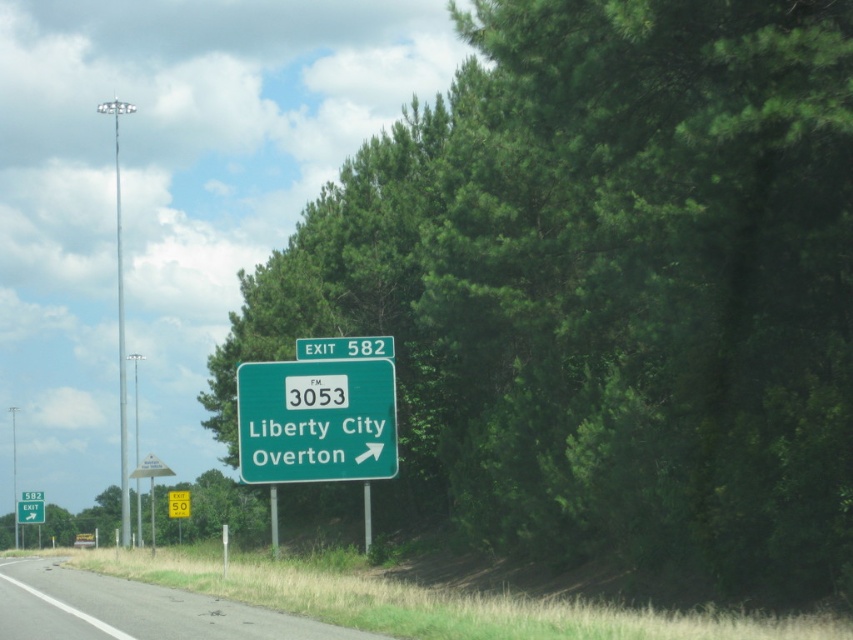
Question: Which object is farther from the camera taking this photo?

Choices:
 (A) gray asphalt road at lower left
 (B) green leafy tree at lower left

Answer: (B)

Question: Which point appears closest to the camera in this image?

Choices:
 (A) (381, 308)
 (B) (86, 600)
 (C) (103, 536)

Answer: (B)

Question: Does gray asphalt road at lower left have a greater width compared to green matte sign at center?

Choices:
 (A) yes
 (B) no

Answer: (A)

Question: Does green leafy tree at lower left appear on the right side of green matte sign at center?

Choices:
 (A) no
 (B) yes

Answer: (A)

Question: Based on their relative distances, which object is nearer to the green matte sign at center?

Choices:
 (A) gray asphalt road at lower left
 (B) green leafy tree at center

Answer: (B)

Question: In this image, where is gray asphalt road at lower left located relative to green matte sign at center?

Choices:
 (A) below
 (B) above

Answer: (A)